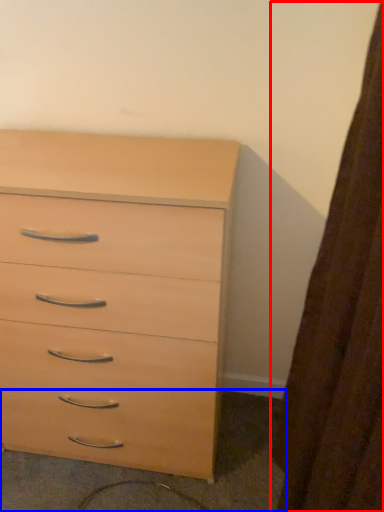
Question: Among these objects, which one is nearest to the camera, curtain (highlighted by a red box) or concrete (highlighted by a blue box)?

Choices:
 (A) curtain
 (B) concrete

Answer: (A)